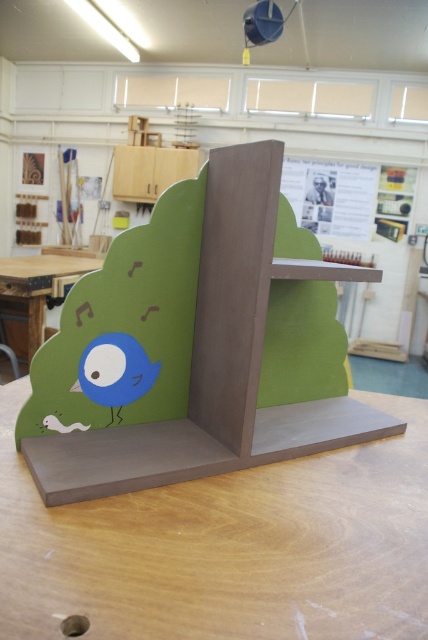
Question: Which object is positioned farthest from the matte blue bird at lower left?

Choices:
 (A) matte wood table at lower left
 (B) matte brown table at center

Answer: (A)

Question: Which of the following is the closest to the observer?

Choices:
 (A) (23, 269)
 (B) (80, 368)
 (C) (394, 401)

Answer: (B)

Question: Is matte brown table at center to the right of matte blue bird at lower left from the viewer's perspective?

Choices:
 (A) yes
 (B) no

Answer: (A)

Question: Is matte brown table at center bigger than matte wood table at lower left?

Choices:
 (A) no
 (B) yes

Answer: (A)

Question: Which point is closer to the camera?

Choices:
 (A) (103, 339)
 (B) (0, 272)

Answer: (A)

Question: Does matte brown table at center come behind matte blue bird at lower left?

Choices:
 (A) yes
 (B) no

Answer: (B)